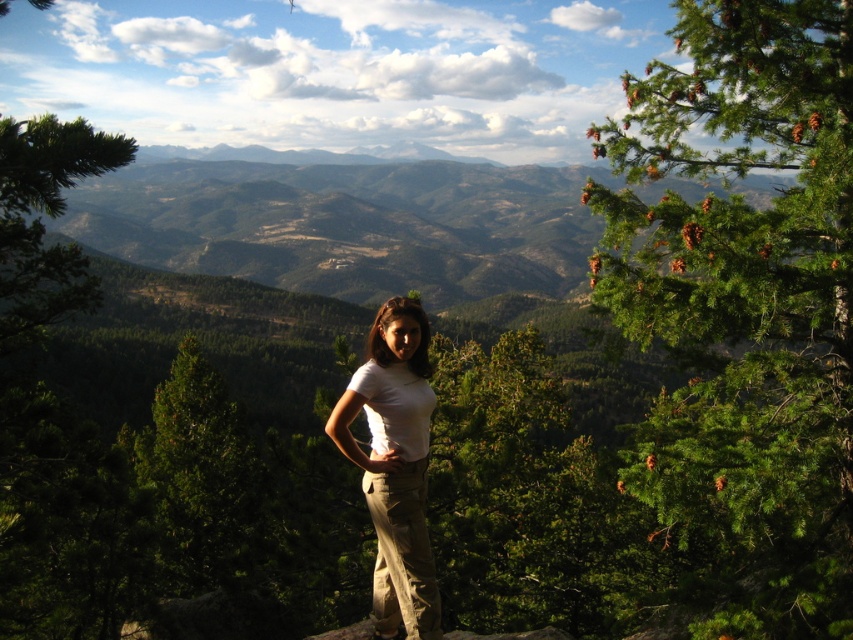
Question: Is green needle-like pine at upper right in front of white cotton shirt at center?

Choices:
 (A) no
 (B) yes

Answer: (B)

Question: Among these objects, which one is farthest from the camera?

Choices:
 (A) white cotton shirt at center
 (B) green needle-like pine at upper right

Answer: (A)

Question: Does green needle-like pine at upper right have a larger size compared to white cotton shirt at center?

Choices:
 (A) yes
 (B) no

Answer: (A)

Question: Is green needle-like pine at upper right below white cotton shirt at center?

Choices:
 (A) yes
 (B) no

Answer: (B)

Question: Which point appears farthest from the camera in this image?

Choices:
 (A) (618, 216)
 (B) (387, 577)

Answer: (A)